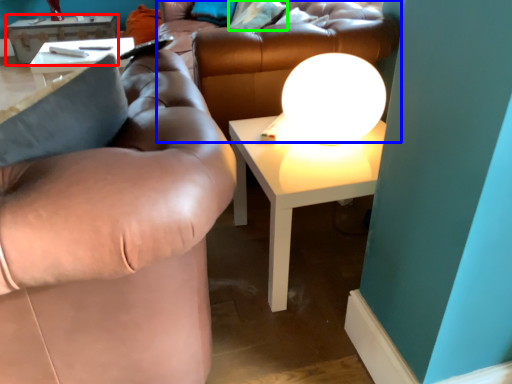
Question: Which object is the farthest from table (highlighted by a red box)? Choose among these: couch (highlighted by a blue box) or pillow (highlighted by a green box).

Choices:
 (A) couch
 (B) pillow

Answer: (A)